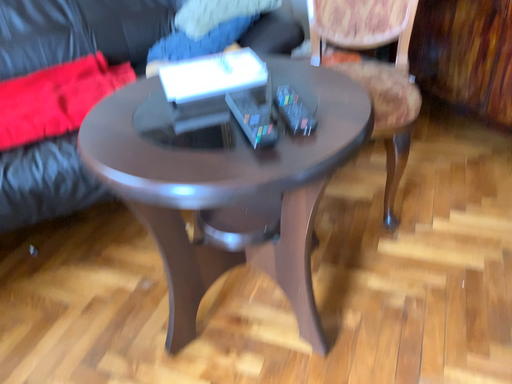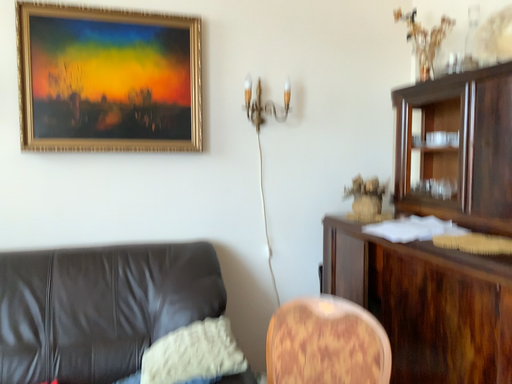
Question: How did the camera likely rotate when shooting the video?

Choices:
 (A) rotated upward
 (B) rotated downward

Answer: (A)